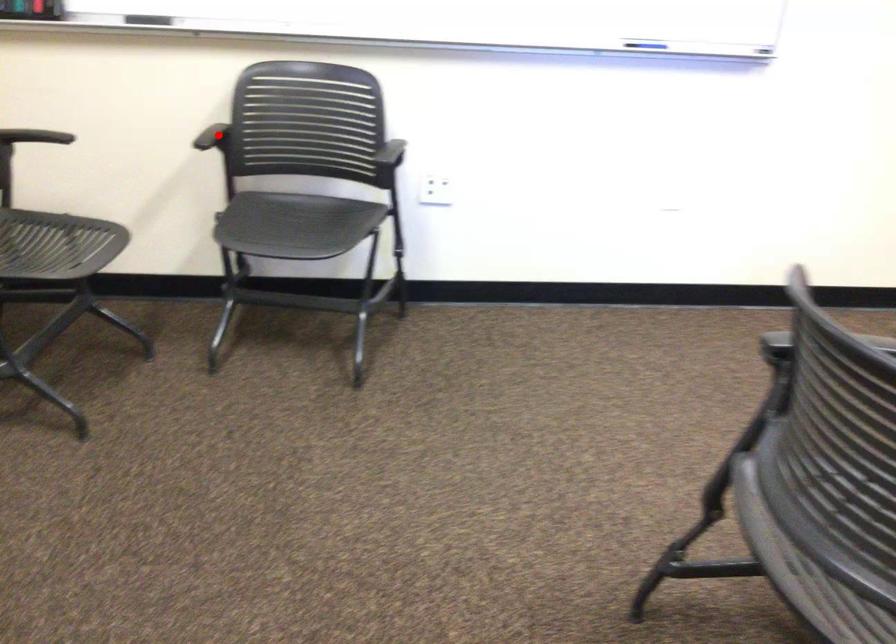
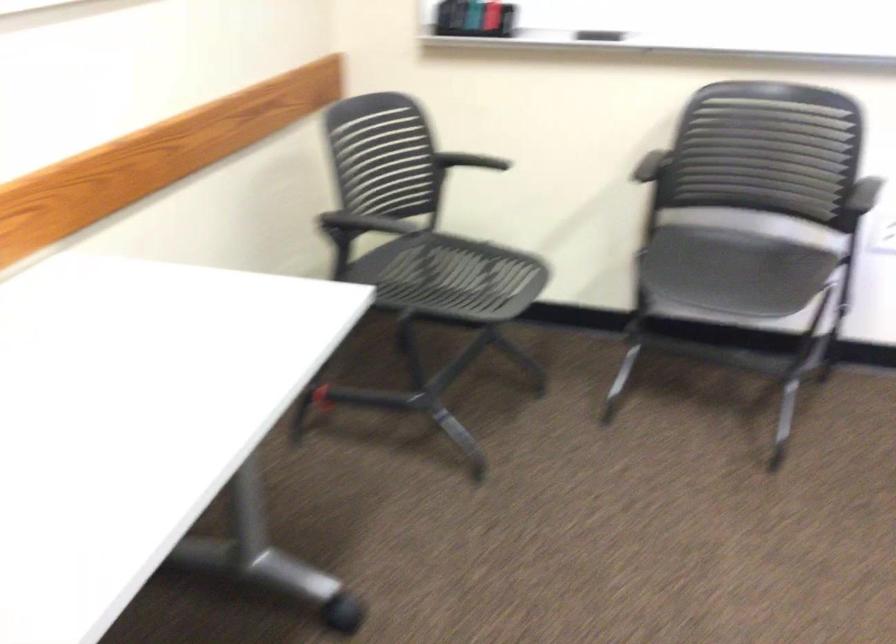
Locate, in the second image, the point that corresponds to the highlighted location in the first image.

(649, 166)